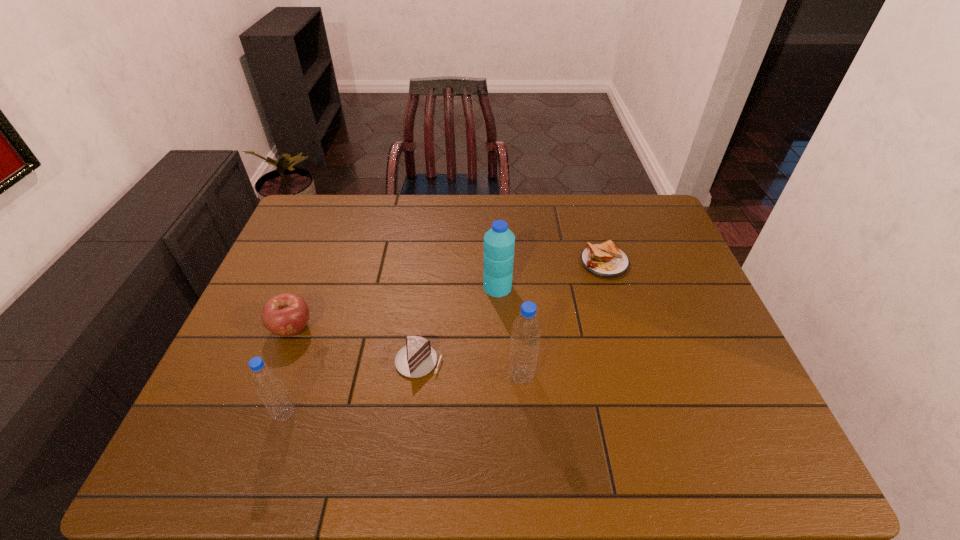
Locate an element on the screen. object identified as the fourth closest to the rightmost object is located at coordinates (287, 314).

Identify which water bottle is located as the second nearest to the shortest object. Please provide its 2D coordinates. Your answer should be formatted as a tuple, i.e. [(x, y)], where the tuple contains the x and y coordinates of a point satisfying the conditions above.

[(526, 330)]

Identify which water bottle is located as the second nearest to the nearest water bottle. Please provide its 2D coordinates. Your answer should be formatted as a tuple, i.e. [(x, y)], where the tuple contains the x and y coordinates of a point satisfying the conditions above.

[(499, 242)]

I want to click on vacant position in the image that satisfies the following two spatial constraints: 1. on the side of the fourth object from right to left with the unique marking; 2. on the right side of the third shortest object, so (x=279, y=361).

The height and width of the screenshot is (540, 960). I want to click on free point that satisfies the following two spatial constraints: 1. on the back side of the leftmost water bottle; 2. on the right side of the second nearest water bottle, so click(x=299, y=376).

This screenshot has width=960, height=540. In order to click on vacant space that satisfies the following two spatial constraints: 1. on the back side of the farthest water bottle; 2. on the left side of the chocolate cake in this screenshot , I will do `click(428, 287)`.